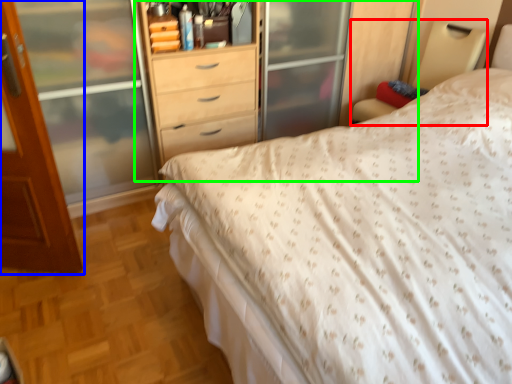
Question: Which object is positioned closest to bed frame (highlighted by a red box)? Select from door (highlighted by a blue box) and dresser (highlighted by a green box).

Choices:
 (A) door
 (B) dresser

Answer: (B)